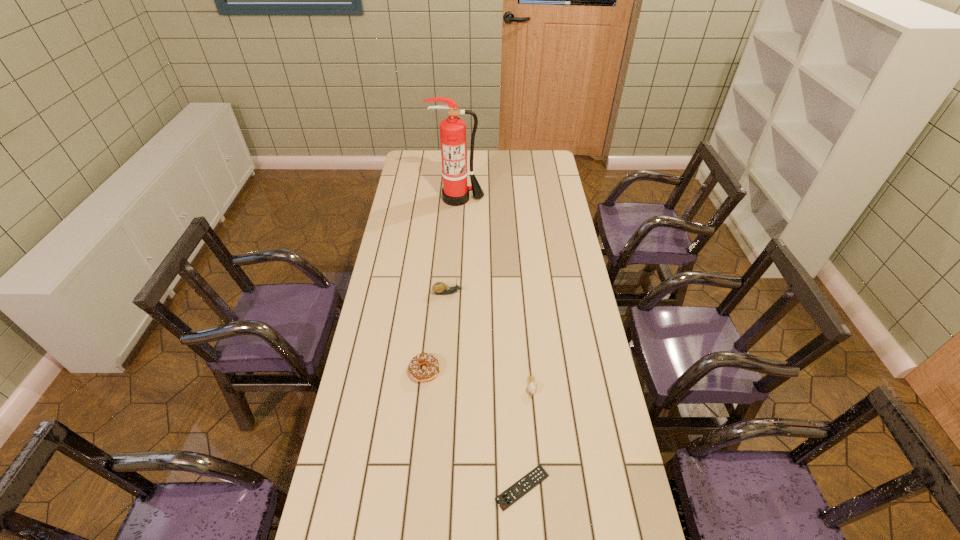
This screenshot has width=960, height=540. What are the coordinates of `vacant space that is in between the taller escargot and the fire extinguisher` in the screenshot? It's located at (453, 246).

This screenshot has width=960, height=540. In order to click on vacant area that lies between the remote control and the fourth shortest object in this screenshot , I will do `click(485, 390)`.

This screenshot has width=960, height=540. What are the coordinates of `vacant point located between the left escargot and the doughnut` in the screenshot? It's located at (436, 332).

Locate an element on the screen. The height and width of the screenshot is (540, 960). free space between the left escargot and the doughnut is located at coordinates (436, 332).

At what (x,y) coordinates should I click in order to perform the action: click on free area in between the farthest object and the shortest object. Please return your answer as a coordinate pair (x, y). Looking at the image, I should click on (491, 343).

The height and width of the screenshot is (540, 960). In order to click on free point between the second shortest object and the tallest object in this screenshot , I will do `click(494, 293)`.

Locate an element on the screen. Image resolution: width=960 pixels, height=540 pixels. blank region between the fourth tallest object and the nearest object is located at coordinates (527, 437).

This screenshot has width=960, height=540. What are the coordinates of `free space between the right escargot and the doughnut` in the screenshot? It's located at (478, 379).

At what (x,y) coordinates should I click in order to perform the action: click on the third closest object to the doughnut. Please return your answer as a coordinate pair (x, y). This screenshot has height=540, width=960. Looking at the image, I should click on click(x=507, y=498).

Identify which object is the third nearest to the doughnut. Please provide its 2D coordinates. Your answer should be formatted as a tuple, i.e. [(x, y)], where the tuple contains the x and y coordinates of a point satisfying the conditions above.

[(507, 498)]